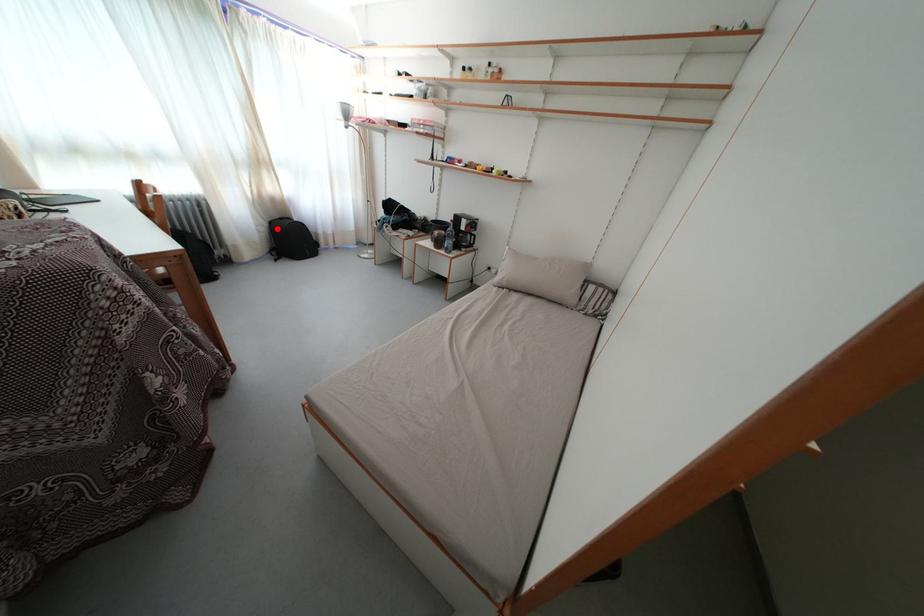
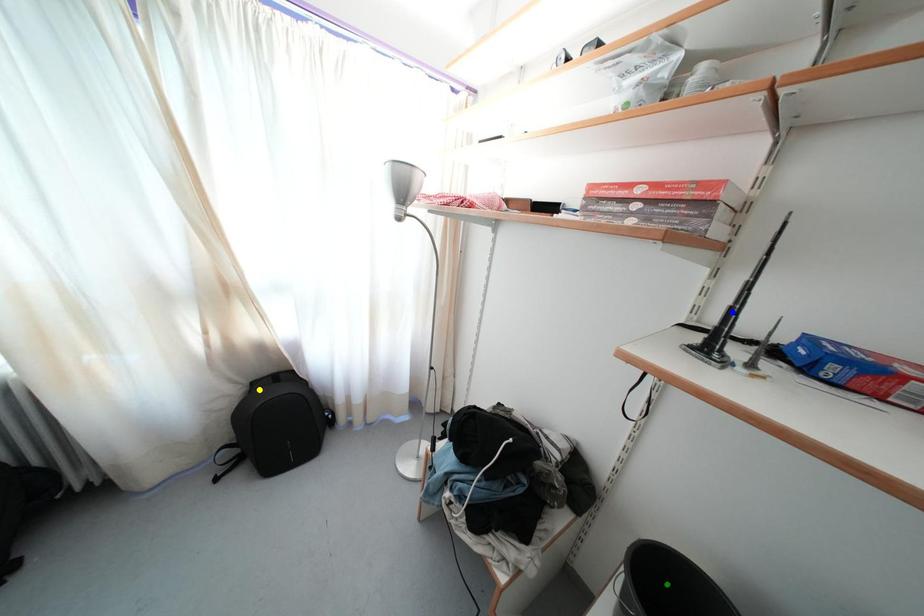
Question: I am providing you with two images of the same scene from different viewpoints. A red point is marked on the first image. You are given multiple points on the second image. Which spot in image 2 lines up with the point in image 1?

Choices:
 (A) blue point
 (B) yellow point
 (C) green point

Answer: (B)